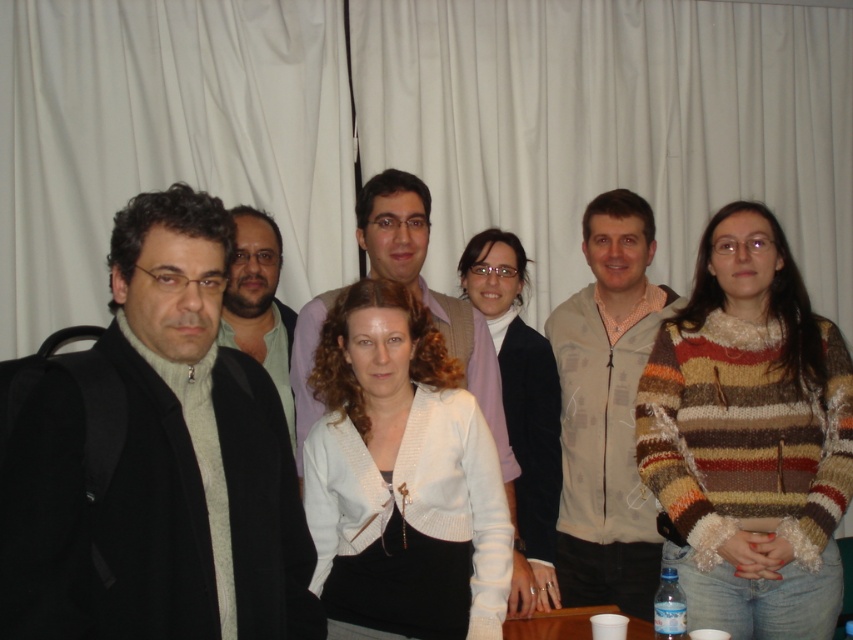
Can you confirm if white knitted cardigan at center is positioned above white knitted sweater at center?

Actually, white knitted cardigan at center is below white knitted sweater at center.

Between point (451, 566) and point (532, 595), which one is positioned in front?

Positioned in front is point (451, 566).

Is point (412, 413) in front of point (526, 445)?

Yes, point (412, 413) is in front of point (526, 445).

Where is `white knitted cardigan at center`? The height and width of the screenshot is (640, 853). white knitted cardigan at center is located at coordinates (401, 476).

This screenshot has width=853, height=640. Find the location of `knitted striped sweater at center`. knitted striped sweater at center is located at coordinates (749, 436).

Who is positioned more to the left, knitted striped sweater at center or white knitted cardigan at center?

white knitted cardigan at center is more to the left.

Who is more forward, (701, 486) or (370, 340)?

Point (370, 340) is more forward.

Find the location of a particular element. The height and width of the screenshot is (640, 853). knitted striped sweater at center is located at coordinates (749, 436).

Which is more to the left, white knitted sweater at center or matte green shirt at center?

Positioned to the left is matte green shirt at center.

This screenshot has width=853, height=640. I want to click on white knitted sweater at center, so click(x=521, y=410).

Which is in front, point (488, 294) or point (262, 257)?

Point (262, 257) is more forward.

Identify the location of white knitted sweater at center. (521, 410).